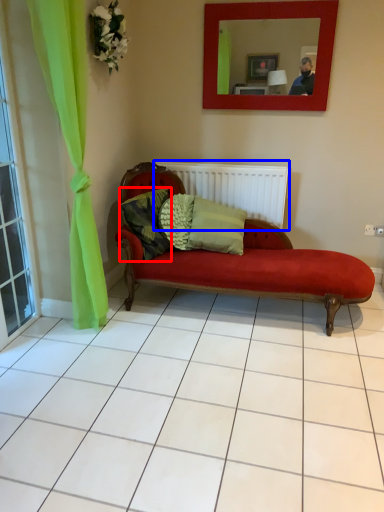
Question: Which of the following is the farthest to the observer, pillow (highlighted by a red box) or radiator (highlighted by a blue box)?

Choices:
 (A) pillow
 (B) radiator

Answer: (B)